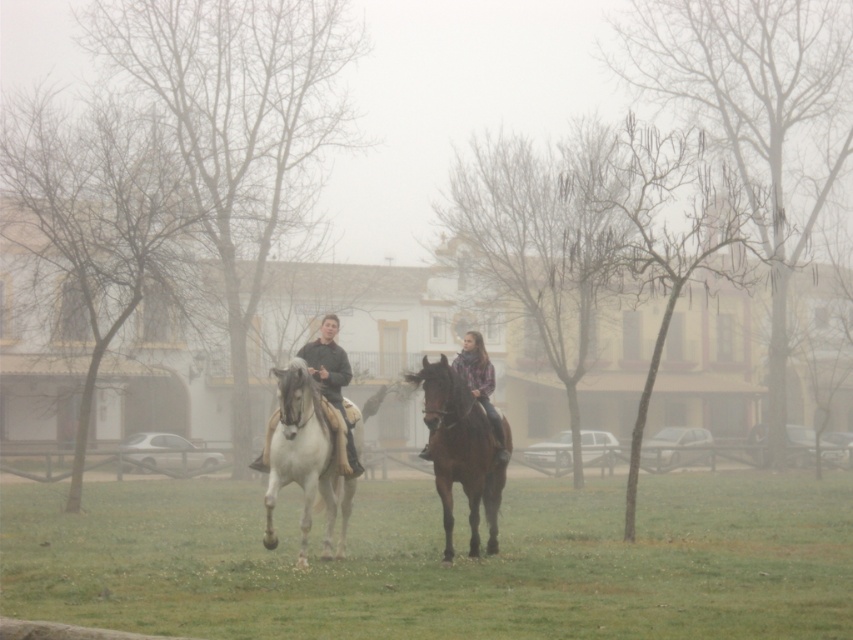
Question: Does white glossy horse at center have a greater width compared to plaid fabric shirt at center?

Choices:
 (A) yes
 (B) no

Answer: (A)

Question: Is green grass at center smaller than plaid fabric shirt at center?

Choices:
 (A) yes
 (B) no

Answer: (B)

Question: Which is farther from the white glossy horse at center?

Choices:
 (A) brown glossy horse at center
 (B) green grass at center
 (C) dark green leather jacket at center
 (D) plaid fabric shirt at center

Answer: (B)

Question: Which point is farther to the camera?

Choices:
 (A) (334, 384)
 (B) (422, 452)
 (C) (91, 547)

Answer: (C)

Question: Which point appears closest to the camera in this image?

Choices:
 (A) [463, 392]
 (B) [469, 342]
 (C) [590, 616]
 (D) [335, 314]

Answer: (C)

Question: Can you confirm if green grass at center is positioned to the left of dark green leather jacket at center?

Choices:
 (A) no
 (B) yes

Answer: (A)